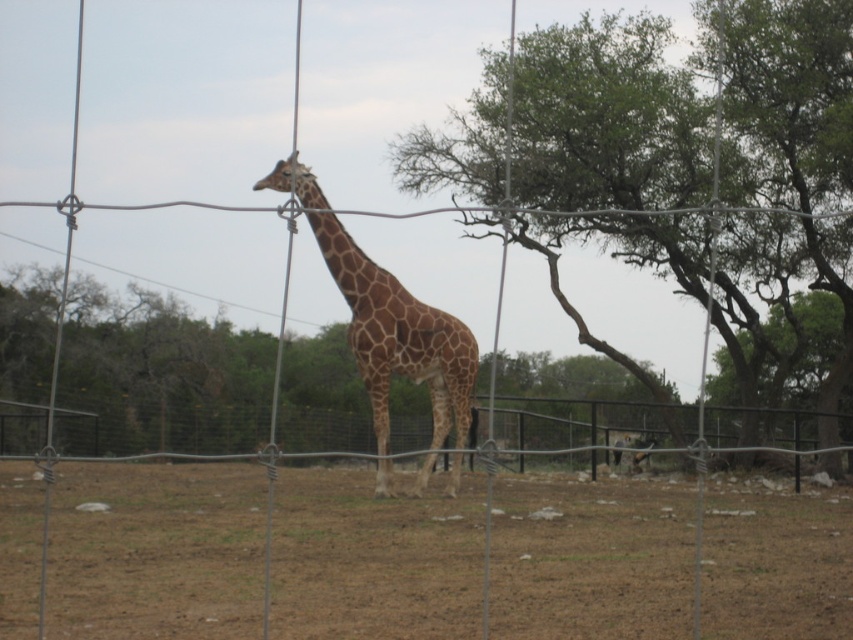
You are a zookeeper planning to feed the brown spotted giraffe at center. You have a bucket of leaves placed at the green leafy tree at center. Can you directly toss the leaves from the tree to the giraffe without the leaves falling elsewhere?

The green leafy tree at center is positioned over the brown spotted giraffe at center, so yes, you can directly toss the leaves from the tree to the giraffe without them falling elsewhere because the tree is above the giraffe.

You are a zookeeper who needs to ensure the safety of the brown spotted giraffe at center. The enclosure has a fence that is 2 meters tall. Considering the height of the brown soil at center and the giraffe, do you think the giraffe can jump over the fence?

The brown soil at center is much taller than the brown spotted giraffe at center, so the giraffe would not be able to jump over the fence since it is shorter than the soil, which is already taller than the fence height of 2 meters.